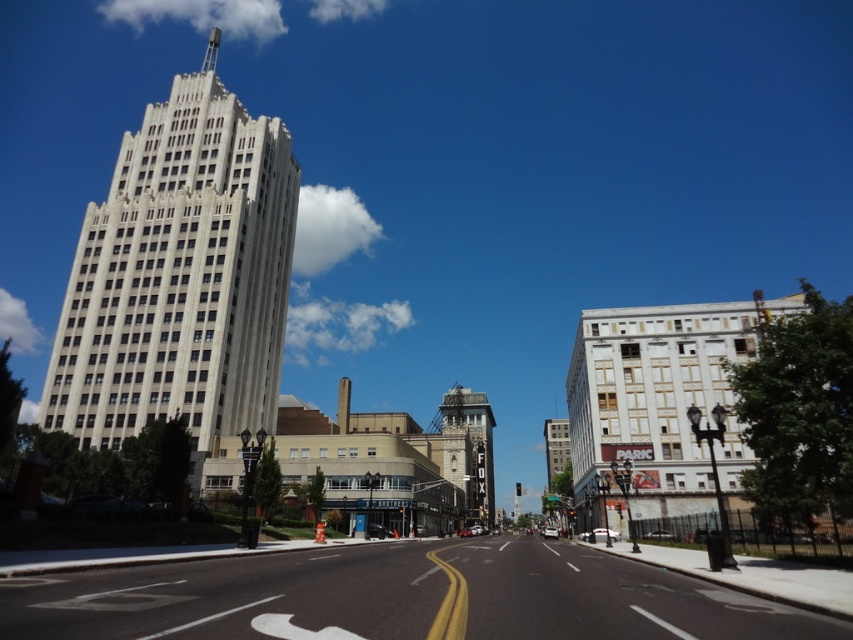
You are standing on the sidewalk in this urban scene. You see the white stone building at left and the gray stone clock tower at center. Which building is closer to you?

The white stone building at left is closer to you because it is in front of the gray stone clock tower at center.

You are standing at the center of the street in the image. Which direction should you walk to reach the white stone building at left?

Since the white stone building at left is located at point (180, 276), you should walk towards the left side of the image to reach it.

Based on the photo, you are standing on the sidewalk and see both the white stone building at left and the gray stone clock tower at center. Which building is closer to you?

The white stone building at left is closer to you because it is positioned over the gray stone clock tower at center, indicating it is in front.